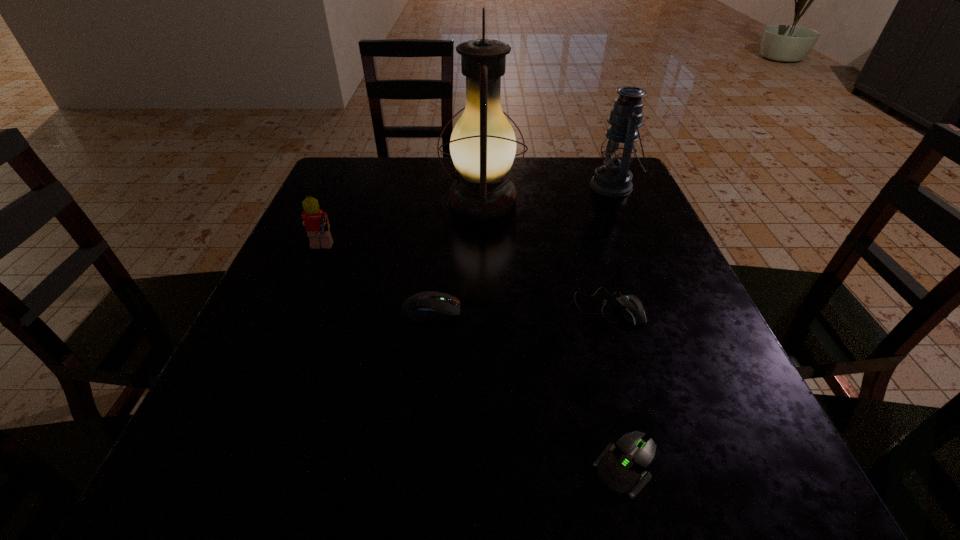
Where is `empty space that is in between the fifth shortest object and the leftmost object`? empty space that is in between the fifth shortest object and the leftmost object is located at coordinates (467, 219).

The height and width of the screenshot is (540, 960). What are the coordinates of `empty location between the leftmost object and the tallest object` in the screenshot? It's located at (401, 226).

I want to click on free space between the nearest computer mouse and the Lego, so click(473, 359).

At what (x,y) coordinates should I click in order to perform the action: click on blank region between the oil lamp and the nearest computer mouse. Please return your answer as a coordinate pair (x, y). The width and height of the screenshot is (960, 540). Looking at the image, I should click on (554, 334).

Identify the location of free space that is in between the fifth shortest object and the third tallest object. The image size is (960, 540). (467, 219).

Identify which object is located as the second nearest to the third shortest object. Please provide its 2D coordinates. Your answer should be formatted as a tuple, i.e. [(x, y)], where the tuple contains the x and y coordinates of a point satisfying the conditions above.

[(631, 307)]

Locate which object ranks second in proximity to the tallest computer mouse. Please provide its 2D coordinates. Your answer should be formatted as a tuple, i.e. [(x, y)], where the tuple contains the x and y coordinates of a point satisfying the conditions above.

[(631, 307)]

Locate which computer mouse ranks in proximity to the Lego. Please provide its 2D coordinates. Your answer should be formatted as a tuple, i.e. [(x, y)], where the tuple contains the x and y coordinates of a point satisfying the conditions above.

[(429, 305)]

Identify which computer mouse is the nearest to the tallest object. Please provide its 2D coordinates. Your answer should be formatted as a tuple, i.e. [(x, y)], where the tuple contains the x and y coordinates of a point satisfying the conditions above.

[(631, 307)]

Find the location of a particular element. This screenshot has height=540, width=960. vacant space that satisfies the following two spatial constraints: 1. on the front-facing side of the second tallest object; 2. on the front side of the oil lamp is located at coordinates (620, 201).